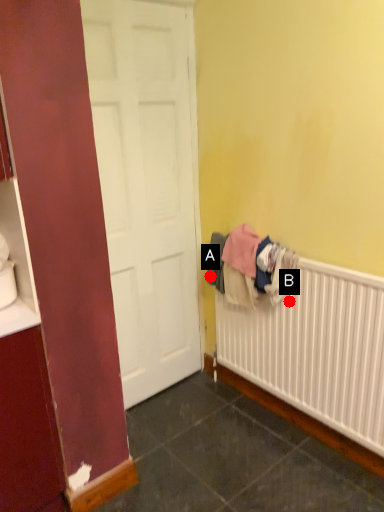
Question: Two points are circled on the image, labeled by A and B beside each circle. Which of the following is the closest to the observer?

Choices:
 (A) A is closer
 (B) B is closer

Answer: (B)